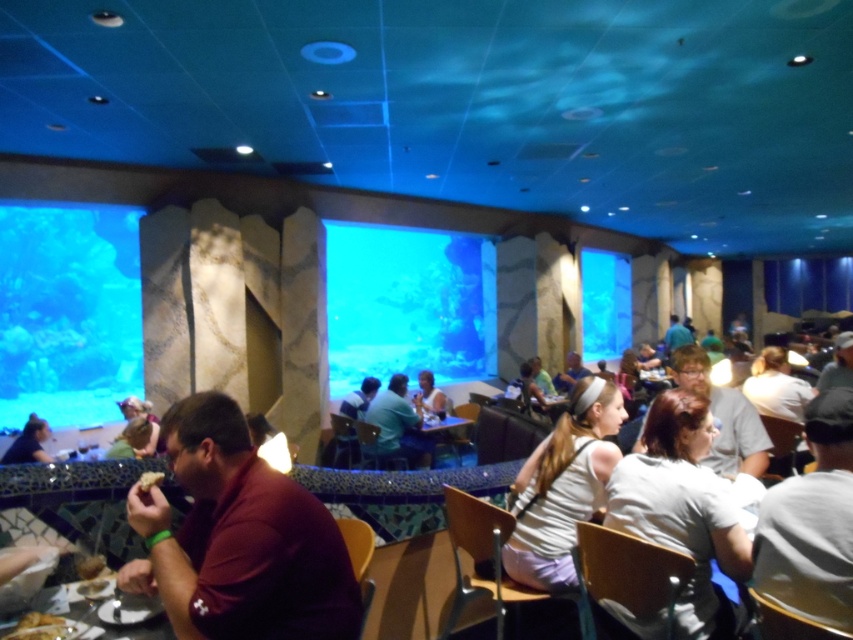
You are a guest seated at the table in the dining area. You want to pass the golden crispy bread at lower left to the person with light brown hair at center. Can you hand it directly without moving from your seat?

The golden crispy bread at lower left is closer to the viewer than light brown hair at center, so you can hand it directly without moving from your seat because the bread is nearer to you than the person with light brown hair at center.

You are a photographer standing at the entrance of the dining area. You want to take a photo of the white matte shirt at lower right. Where should you position yourself to capture it in the frame?

To capture the white matte shirt at lower right in the frame, position yourself at the entrance and aim your camera towards the lower right area of the dining area, specifically targeting the coordinates point (682, 508) where the shirt is located.

You are a guest in this dining area and want to move from your current position to the exit, which is near the point at coordinates point (x=144, y=480). However, there is an obstacle at point (x=708, y=560). Can you safely navigate around the obstacle to reach the exit?

Point (x=708, y=560) is behind point (x=144, y=480), so the obstacle is located behind the exit. Therefore, you can safely reach the exit without encountering the obstacle.